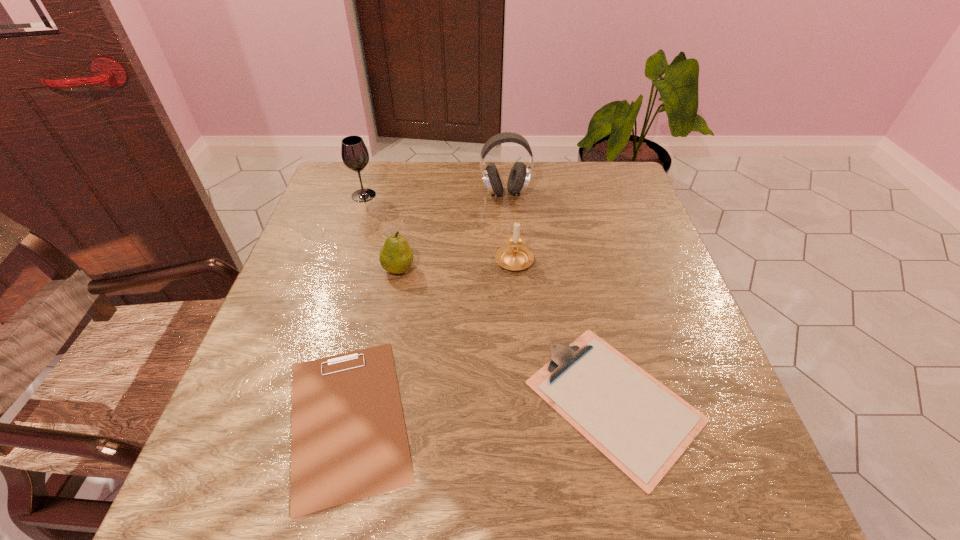
Find the location of a particular element. The width and height of the screenshot is (960, 540). vacant space located 0.190m with a handle on the side of the candle holder is located at coordinates (510, 200).

This screenshot has height=540, width=960. I want to click on vacant space located with a handle on the side of the candle holder, so click(509, 192).

The height and width of the screenshot is (540, 960). Find the location of `vacant area situated with a handle on the side of the candle holder`. vacant area situated with a handle on the side of the candle holder is located at coordinates (510, 200).

Locate an element on the screen. The height and width of the screenshot is (540, 960). vacant space located on the left of the pear is located at coordinates (324, 269).

Where is `free space located 0.120m on the left of the second shortest object`? Image resolution: width=960 pixels, height=540 pixels. free space located 0.120m on the left of the second shortest object is located at coordinates (462, 401).

Identify the location of vacant space located 0.280m on the right of the left clipboard. (579, 419).

The image size is (960, 540). I want to click on headset that is positioned at the far edge, so click(519, 176).

Identify the location of wineglass positioned at the far edge. (355, 156).

At what (x,y) coordinates should I click in order to perform the action: click on wineglass at the left edge. Please return your answer as a coordinate pair (x, y). Looking at the image, I should click on (355, 156).

Locate an element on the screen. clipboard located in the left edge section of the desktop is located at coordinates (348, 442).